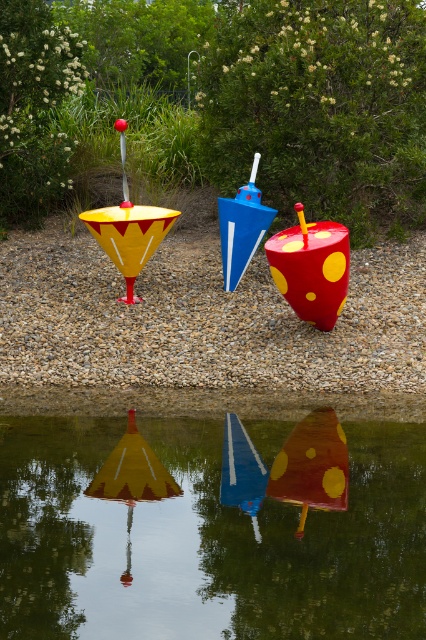
You are standing in a park and see the glossy water at center and the matte yellow and red plastic umbrella at center. Which object is positioned to the right of the other?

The glossy water at center is to the right of the matte yellow and red plastic umbrella at center.

You are standing at the point labeled point (129, 228) in the image. Looking around, you see three sculptures. Which sculpture is directly in front of you?

The point (129, 228) corresponds to the matte yellow and red plastic umbrella at center, so the sculpture directly in front of you is the blue sculpture with a white stripe and white spherical top in the middle.